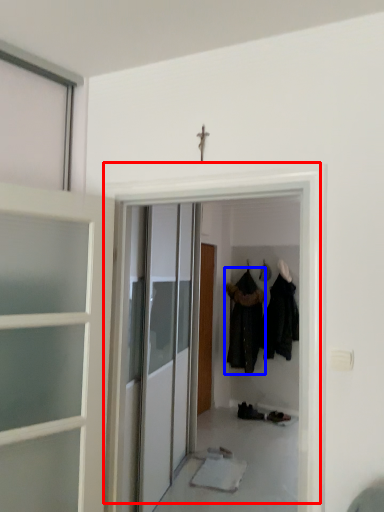
Question: Which point is further to the camera, door (highlighted by a red box) or clothing (highlighted by a blue box)?

Choices:
 (A) door
 (B) clothing

Answer: (B)